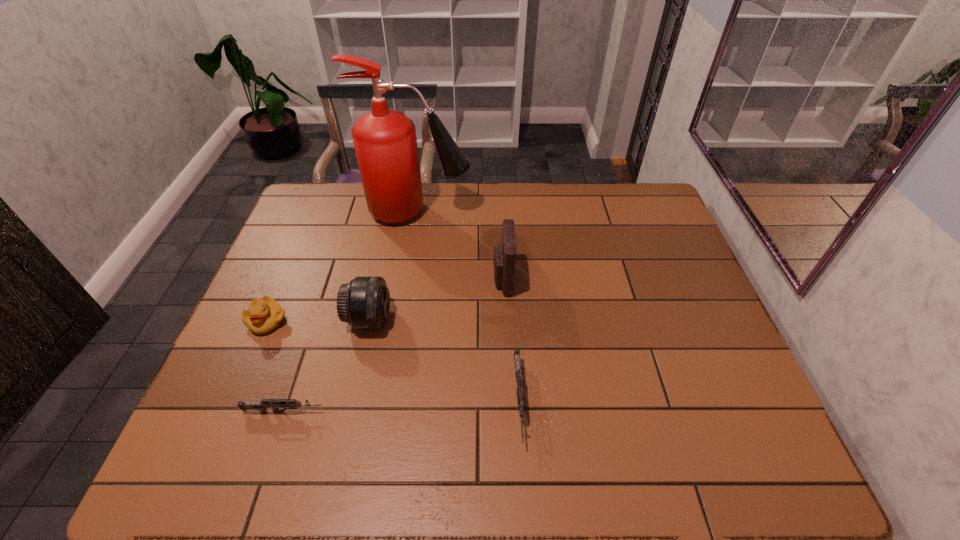
Where is `vacant region located aimed along the barrel of the shorter gun`? The width and height of the screenshot is (960, 540). vacant region located aimed along the barrel of the shorter gun is located at coordinates (422, 412).

You are a GUI agent. You are given a task and a screenshot of the screen. Output one action in this format:
    pyautogui.click(x=<x>, y=<y>)
    Task: Click on the free space located 0.240m with the nozzle aimed from the fire extinguisher
    
    Given the screenshot: What is the action you would take?
    pyautogui.click(x=542, y=212)

Where is `vacant area located 0.400m with an open flap on the second tallest object`? vacant area located 0.400m with an open flap on the second tallest object is located at coordinates (354, 280).

Locate an element on the screen. The image size is (960, 540). vacant space located with an open flap on the second tallest object is located at coordinates click(x=444, y=280).

Where is `blank space located with an open flap on the second tallest object`? blank space located with an open flap on the second tallest object is located at coordinates click(466, 280).

What are the coordinates of `vacant space located 0.160m on the front-facing side of the telephoto lens` in the screenshot? It's located at (x=451, y=320).

Find the location of a particular element. free spot located at the beak of the third shortest object is located at coordinates (235, 397).

Find the location of a particular element. object that is at the far edge is located at coordinates (385, 142).

At what (x,y) coordinates should I click in order to perform the action: click on gun located at the left edge. Please return your answer as a coordinate pair (x, y). The height and width of the screenshot is (540, 960). Looking at the image, I should click on (275, 404).

I want to click on duckling that is at the left edge, so click(x=264, y=315).